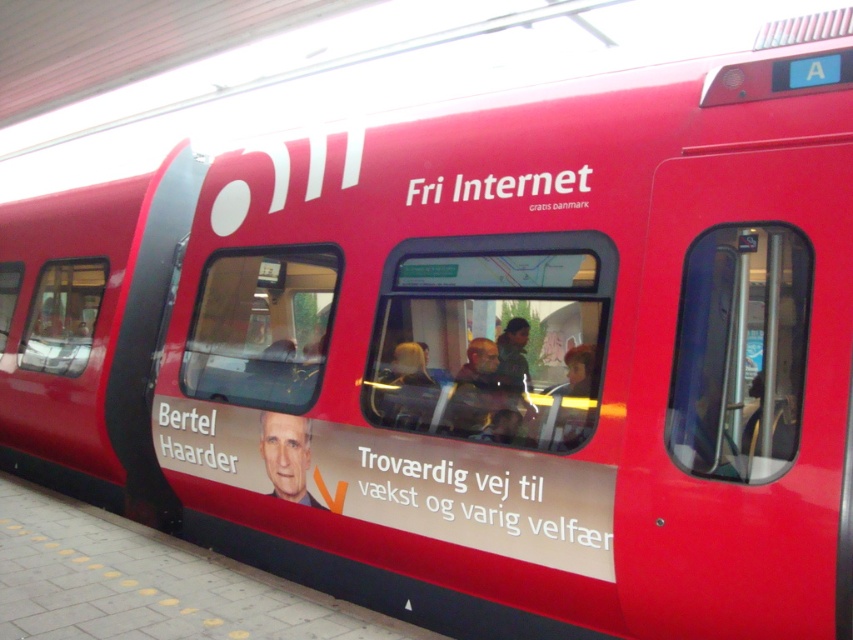
Question: Which is farther from the smooth skin portrait at center?

Choices:
 (A) matte black jacket at center
 (B) light brown hair at center
 (C) green fabric jacket at center
 (D) smooth brown hair at center

Answer: (D)

Question: Does matte black jacket at center appear on the right side of smooth brown hair at center?

Choices:
 (A) yes
 (B) no

Answer: (B)

Question: Which of the following is the farthest from the observer?

Choices:
 (A) (271, 412)
 (B) (505, 404)
 (C) (515, 321)
 (D) (538, 435)

Answer: (A)

Question: Does matte black jacket at center have a greater width compared to smooth skin portrait at center?

Choices:
 (A) yes
 (B) no

Answer: (B)

Question: Does matte black jacket at center have a larger size compared to green fabric jacket at center?

Choices:
 (A) no
 (B) yes

Answer: (B)

Question: Which object appears closest to the camera in this image?

Choices:
 (A) smooth skin portrait at center
 (B) light brown hair at center

Answer: (B)